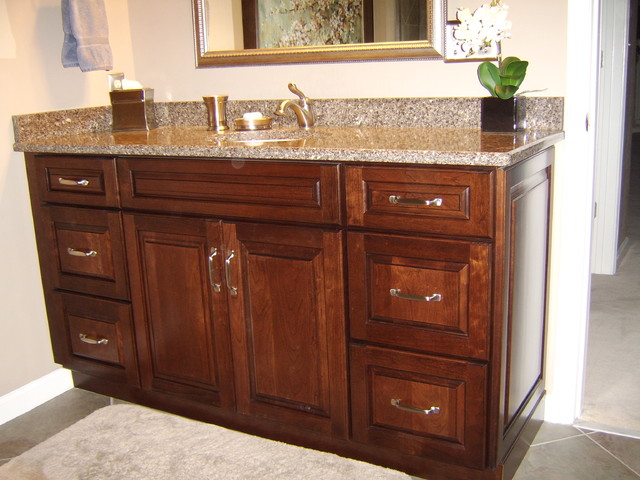
I want to click on mirror, so click(x=312, y=23).